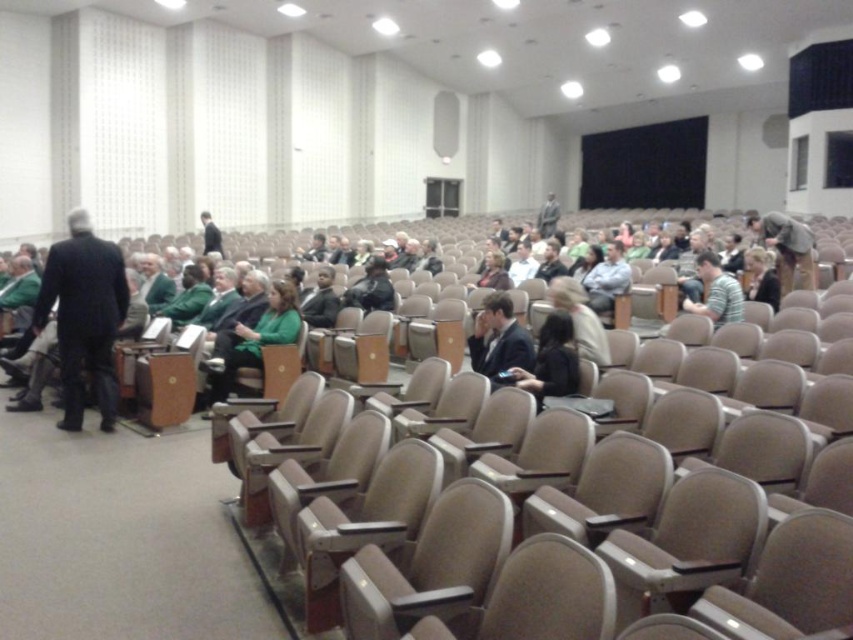
Does dark suit at left have a greater width compared to striped cotton shirt at center?

Correct, the width of dark suit at left exceeds that of striped cotton shirt at center.

Does dark suit at left appear on the left side of striped cotton shirt at center?

Correct, you'll find dark suit at left to the left of striped cotton shirt at center.

Does point (108, 352) come in front of point (706, 268)?

Yes.

Image resolution: width=853 pixels, height=640 pixels. What are the coordinates of `dark suit at left` in the screenshot? It's located at (84, 316).

Can you confirm if brown leather jacket at center is shorter than matte gray shirt at center?

No.

Which is more to the left, brown leather jacket at center or matte gray shirt at center?

Positioned to the left is matte gray shirt at center.

Find the location of a particular element. This screenshot has height=640, width=853. brown leather jacket at center is located at coordinates (785, 244).

Measure the distance from dark suit at center to striped cotton shirt at center.

They are 7.49 feet apart.

Can you confirm if dark suit at center is thinner than striped cotton shirt at center?

In fact, dark suit at center might be wider than striped cotton shirt at center.

Which is behind, point (506, 317) or point (730, 285)?

The point (730, 285) is more distant.

Identify the location of dark suit at center. The image size is (853, 640). (498, 339).